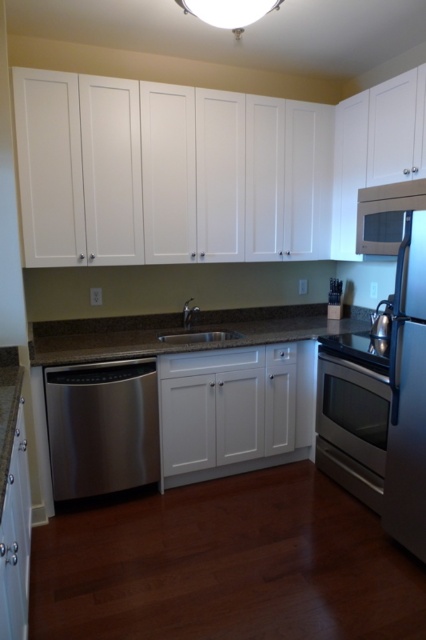
You are standing in the kitchen and want to place a large pot on the brown granite countertop at center. However, there is a satin stainless steel refrigerator at right nearby. Which direction should you move to ensure there is enough space?

You should move to the left side of the brown granite countertop at center because the satin stainless steel refrigerator at right is located to the right of it, leaving more space on the left.

You are a delivery person who needs to place a new microwave that is 1.2 meters wide into the kitchen. The microwave must be placed between the satin stainless steel refrigerator at right and the brown granite countertop at center. Can the microwave fit in the space between them?

The distance between the satin stainless steel refrigerator at right and the brown granite countertop at center is 1.29 meters. Since the microwave is 1.2 meters wide, it can fit in the space between them as the available space is slightly larger than the microwave.

Looking at this image, you are a kitchen designer planning to install a new microwave above the brown granite countertop at center. The microwave needs to be placed under the satin nickel exhaust hood at upper right. Is this possible based on the current layout?

The brown granite countertop at center is located below the satin nickel exhaust hood at upper right, so yes, the microwave can be placed under the satin nickel exhaust hood at upper right above the brown granite countertop at center.